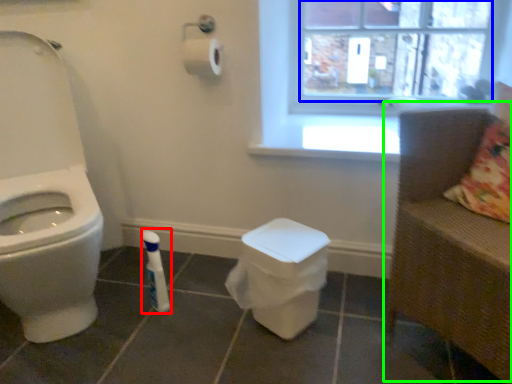
Question: Which is nearer to the toiletry (highlighted by a red box)? window screen (highlighted by a blue box) or armchair (highlighted by a green box).

Choices:
 (A) window screen
 (B) armchair

Answer: (B)